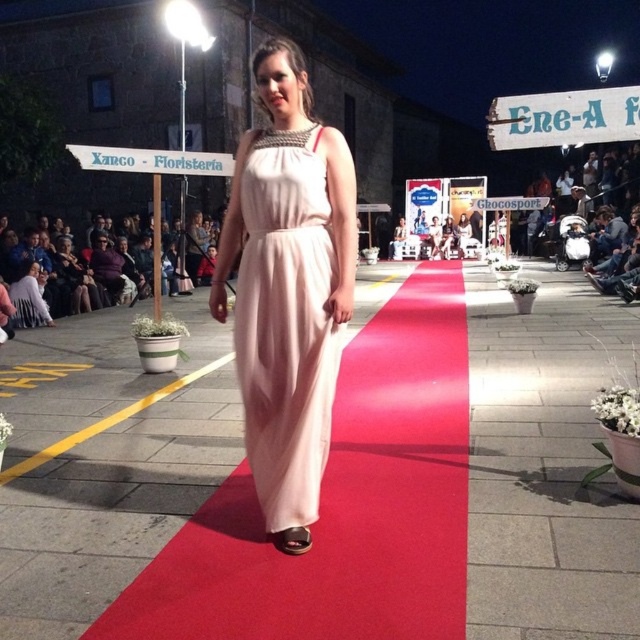
Question: Is matte pink dress at center below matte pink sandal at center?

Choices:
 (A) yes
 (B) no

Answer: (B)

Question: Which object is farther from the camera taking this photo?

Choices:
 (A) matte pink sandal at center
 (B) matte pink dress at center

Answer: (A)

Question: Which point appears closest to the camera in this image?

Choices:
 (A) (276, 156)
 (B) (292, 547)

Answer: (B)

Question: Can you confirm if matte pink dress at center is bigger than matte pink sandal at center?

Choices:
 (A) no
 (B) yes

Answer: (B)

Question: Considering the relative positions of matte pink dress at center and matte pink sandal at center in the image provided, where is matte pink dress at center located with respect to matte pink sandal at center?

Choices:
 (A) left
 (B) right

Answer: (B)

Question: Which point is closer to the camera?

Choices:
 (A) (291, 538)
 (B) (280, 321)

Answer: (A)